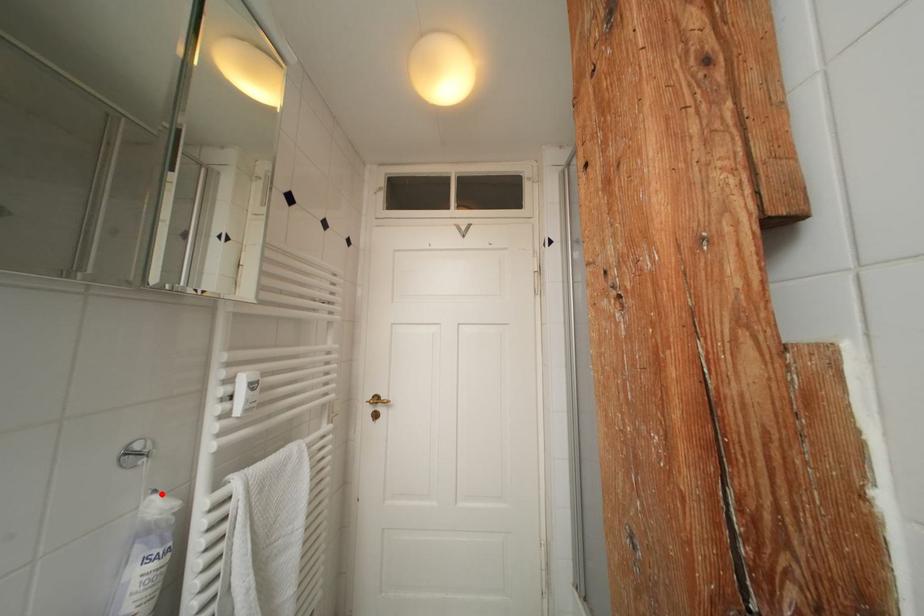
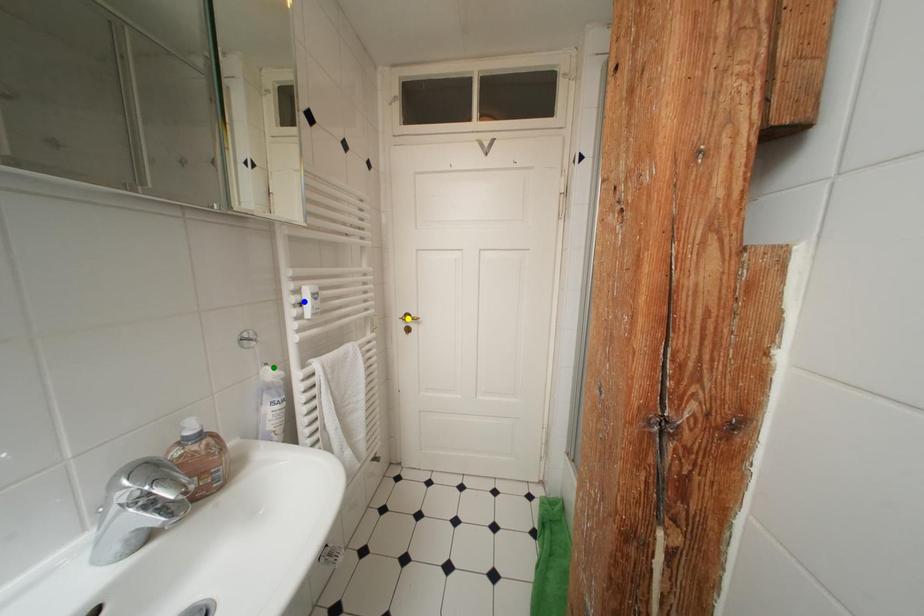
Question: I am providing you with two images of the same scene from different viewpoints. A red point is marked on the first image. You are given multiple points on the second image. Which point in image 2 represents the same 3d spot as the red point in image 1?

Choices:
 (A) green point
 (B) yellow point
 (C) blue point

Answer: (A)